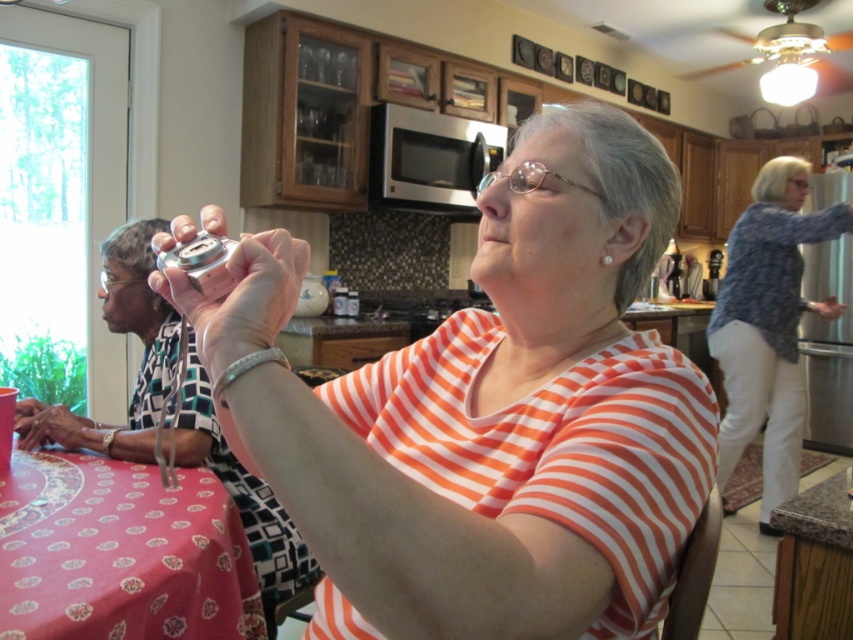
Question: Among these points, which one is farthest from the camera?

Choices:
 (A) pyautogui.click(x=781, y=516)
 (B) pyautogui.click(x=634, y=230)
 (C) pyautogui.click(x=236, y=600)

Answer: (C)

Question: In this image, where is metallic silver can at center located relative to granite countertop at lower right?

Choices:
 (A) right
 (B) left

Answer: (B)

Question: Can you confirm if blue textured sweater at right is positioned below granite countertop at lower right?

Choices:
 (A) no
 (B) yes

Answer: (A)

Question: Among these objects, which one is nearest to the camera?

Choices:
 (A) metallic can at upper left
 (B) pink fabric tablecloth at lower left

Answer: (A)

Question: Does pink fabric tablecloth at lower left appear on the right side of blue textured sweater at right?

Choices:
 (A) no
 (B) yes

Answer: (A)

Question: Estimate the real-world distances between objects in this image. Which object is closer to the metallic can at upper left?

Choices:
 (A) granite countertop at lower right
 (B) pink fabric tablecloth at lower left
 (C) blue textured sweater at right

Answer: (B)